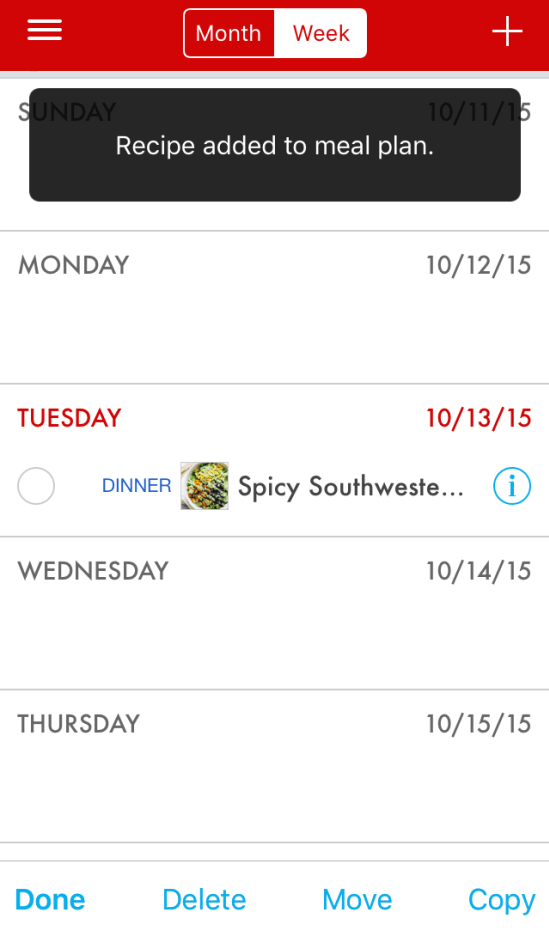
Locate an element on the screen. The height and width of the screenshot is (936, 549). grey dividers is located at coordinates (201, 861), (225, 841), (266, 688), (83, 230), (200, 386), (255, 542).